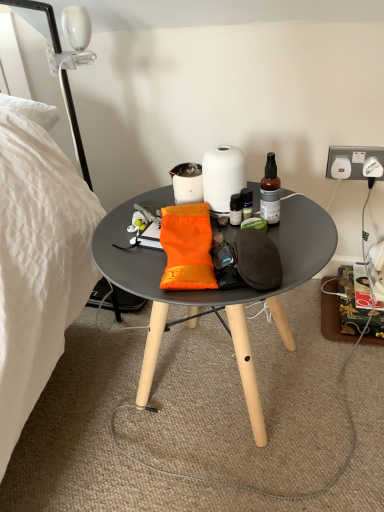
Question: Is matte white coffee cup at center bigger than white glossy lamp at upper left?

Choices:
 (A) no
 (B) yes

Answer: (A)

Question: Is matte white coffee cup at center wider than white glossy lamp at upper left?

Choices:
 (A) yes
 (B) no

Answer: (B)

Question: Does matte white coffee cup at center appear on the right side of white glossy lamp at upper left?

Choices:
 (A) yes
 (B) no

Answer: (A)

Question: From a real-world perspective, is matte white coffee cup at center positioned under white glossy lamp at upper left based on gravity?

Choices:
 (A) yes
 (B) no

Answer: (A)

Question: Is matte white coffee cup at center looking in the opposite direction of white glossy lamp at upper left?

Choices:
 (A) yes
 (B) no

Answer: (B)

Question: Is matte white coffee cup at center far from white glossy lamp at upper left?

Choices:
 (A) yes
 (B) no

Answer: (B)

Question: Can you confirm if white plastic power outlet at upper right is shorter than orange fabric pouch at center?

Choices:
 (A) no
 (B) yes

Answer: (A)

Question: From a real-world perspective, is white plastic power outlet at upper right physically above orange fabric pouch at center?

Choices:
 (A) no
 (B) yes

Answer: (A)

Question: Is white plastic power outlet at upper right thinner than orange fabric pouch at center?

Choices:
 (A) yes
 (B) no

Answer: (A)

Question: Considering the relative sizes of white plastic power outlet at upper right and orange fabric pouch at center in the image provided, is white plastic power outlet at upper right wider than orange fabric pouch at center?

Choices:
 (A) no
 (B) yes

Answer: (A)

Question: Considering the relative sizes of white plastic power outlet at upper right and orange fabric pouch at center in the image provided, is white plastic power outlet at upper right bigger than orange fabric pouch at center?

Choices:
 (A) no
 (B) yes

Answer: (A)

Question: Is white plastic power outlet at upper right to the left of orange fabric pouch at center from the viewer's perspective?

Choices:
 (A) no
 (B) yes

Answer: (A)

Question: Is matte white coffee cup at center located outside orange fabric pouch at center?

Choices:
 (A) no
 (B) yes

Answer: (B)